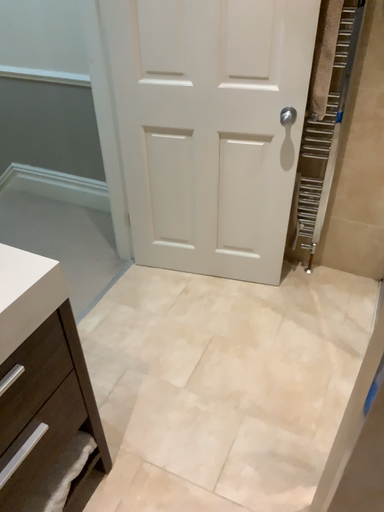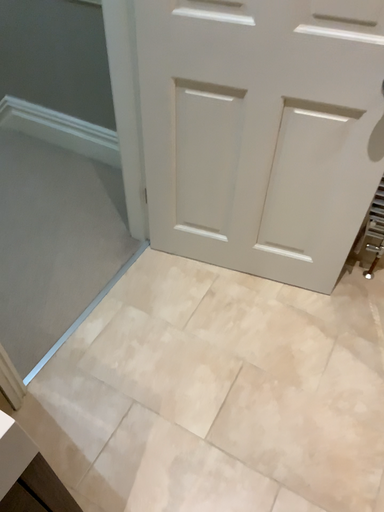
Question: How did the camera likely rotate when shooting the video?

Choices:
 (A) rotated upward
 (B) rotated downward

Answer: (B)